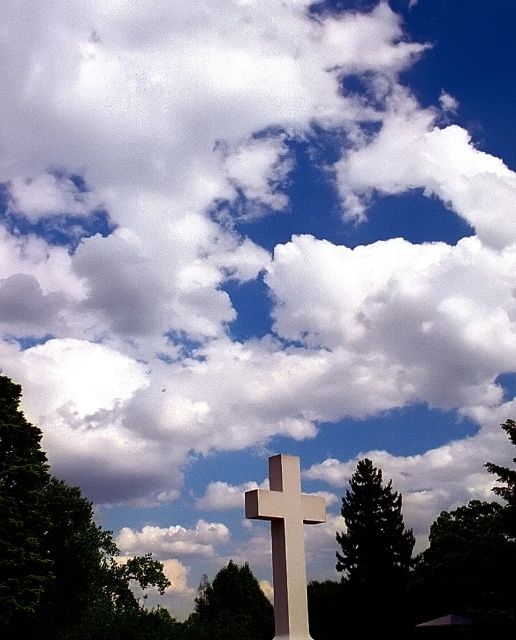
This screenshot has height=640, width=516. What do you see at coordinates (57, 547) in the screenshot?
I see `green leafy tree at upper left` at bounding box center [57, 547].

Locate an element on the screen. The height and width of the screenshot is (640, 516). green leafy tree at upper left is located at coordinates (x=57, y=547).

Is green leafy tree at upper left behind green matte tree at center?

No.

Which is in front, point (36, 532) or point (398, 504)?

Positioned in front is point (36, 532).

Is point (46, 604) less distant than point (359, 474)?

Yes, it is.

The height and width of the screenshot is (640, 516). I want to click on green leafy tree at upper left, so click(x=57, y=547).

Does white smooth cross at center appear under green leafy tree at center?

Actually, white smooth cross at center is above green leafy tree at center.

You are a GUI agent. You are given a task and a screenshot of the screen. Output one action in this format:
    pyautogui.click(x=<x>, y=<y>)
    Task: Click on the white smooth cross at center
    The image size is (516, 640).
    Given the screenshot: What is the action you would take?
    pyautogui.click(x=286, y=540)